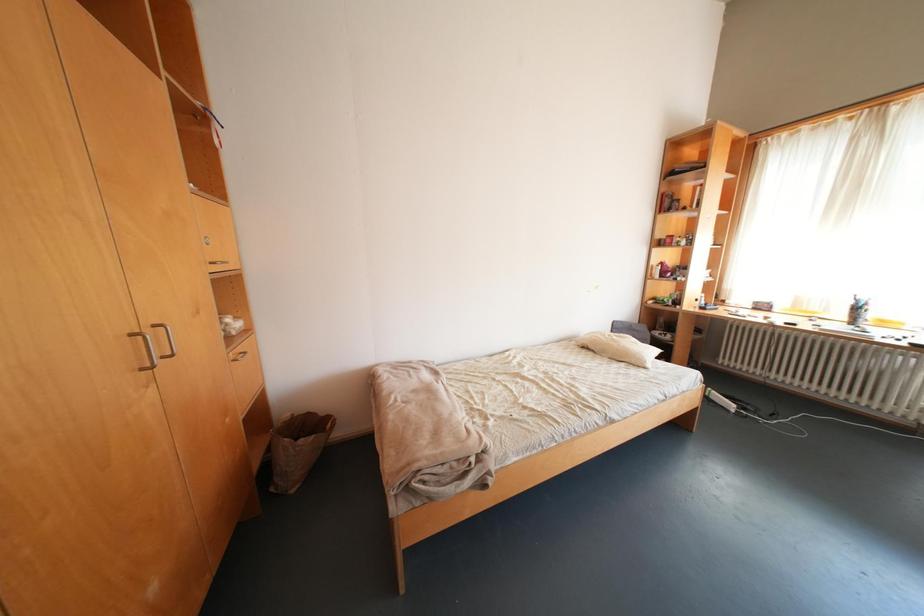
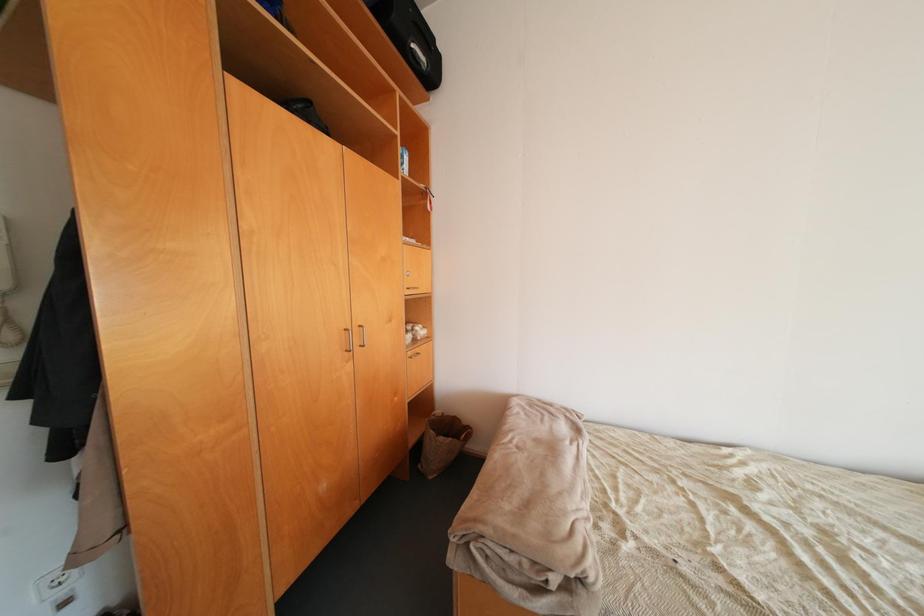
Question: The camera is either moving clockwise (left) or counter-clockwise (right) around the object. The first image is from the beginning of the video and the second image is from the end. Is the camera moving left or right when shooting the video?

Choices:
 (A) Left
 (B) Right

Answer: (B)